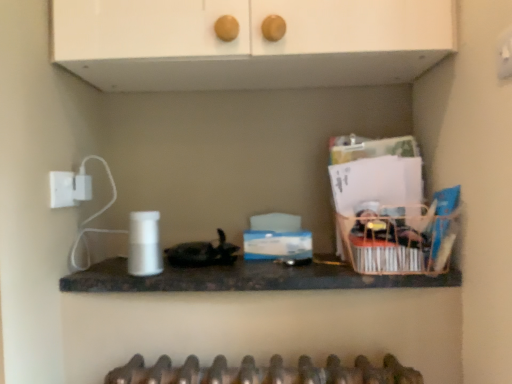
Describe the element at coordinates (398, 242) in the screenshot. I see `wooden basket at right` at that location.

Locate an element on the screen. This screenshot has width=512, height=384. wooden basket at right is located at coordinates (398, 242).

Where is `black marble countertop at center`? black marble countertop at center is located at coordinates (244, 278).

What do you see at coordinates (249, 43) in the screenshot? I see `white matte cabinet at upper center` at bounding box center [249, 43].

This screenshot has width=512, height=384. Identify the location of wooden basket at right. (398, 242).

Is black marble countertop at center positioned beyond the bounds of white matte cabinet at upper center?

That's correct, black marble countertop at center is outside of white matte cabinet at upper center.

From a real-world perspective, between black marble countertop at center and white matte cabinet at upper center, who is vertically higher?

In real-world perspective, white matte cabinet at upper center is above.

Which object is positioned more to the right, black marble countertop at center or white matte cabinet at upper center?

From the viewer's perspective, black marble countertop at center appears more on the right side.

What's the angular difference between black marble countertop at center and white matte cabinet at upper center's facing directions?

The facing directions of black marble countertop at center and white matte cabinet at upper center are 0.407 degrees apart.

Between black marble countertop at center and wooden basket at right, which one has more height?

wooden basket at right is taller.

Is black marble countertop at center far away from wooden basket at right?

No, there isn't a large distance between black marble countertop at center and wooden basket at right.

Which point is more distant from viewer, (242, 289) or (423, 253)?

The point (242, 289) is more distant.

Is white matte cabinet at upper center inside or outside of wooden basket at right?

white matte cabinet at upper center exists outside the volume of wooden basket at right.

Who is bigger, white matte cabinet at upper center or wooden basket at right?

With larger size is white matte cabinet at upper center.

Which of these two, white matte cabinet at upper center or wooden basket at right, stands taller?

Standing taller between the two is white matte cabinet at upper center.

From a real-world perspective, is white matte cabinet at upper center below wooden basket at right?

No.

From a real-world perspective, is wooden basket at right positioned above or below white matte cabinet at upper center?

wooden basket at right is situated lower than white matte cabinet at upper center in the real world.

Which of these two, wooden basket at right or white matte cabinet at upper center, is bigger?

Bigger between the two is white matte cabinet at upper center.

Would you say white matte cabinet at upper center is part of wooden basket at right's contents?

No, white matte cabinet at upper center is not surrounded by wooden basket at right.

Between point (375, 238) and point (159, 61), which one is positioned in front?

The point (375, 238) is closer to the camera.

Considering the relative positions of white matte cabinet at upper center and black marble countertop at center in the image provided, is white matte cabinet at upper center to the left or to the right of black marble countertop at center?

Based on their positions, white matte cabinet at upper center is located to the left of black marble countertop at center.

Which is correct: white matte cabinet at upper center is inside black marble countertop at center, or outside of it?

The correct answer is: outside.

Is white matte cabinet at upper center far away from black marble countertop at center?

white matte cabinet at upper center is actually quite close to black marble countertop at center.

How distant is white matte cabinet at upper center from black marble countertop at center?

white matte cabinet at upper center and black marble countertop at center are 20.85 inches apart.

Is wooden basket at right thinner than black marble countertop at center?

Correct, the width of wooden basket at right is less than that of black marble countertop at center.

Can you confirm if wooden basket at right is taller than black marble countertop at center?

Correct, wooden basket at right is much taller as black marble countertop at center.

Is wooden basket at right at the left side of black marble countertop at center?

No, wooden basket at right is not to the left of black marble countertop at center.

The image size is (512, 384). Identify the location of countertop that appears below the wooden basket at right (from a real-world perspective). (244, 278).

The height and width of the screenshot is (384, 512). I want to click on countertop beneath the white matte cabinet at upper center (from a real-world perspective), so click(x=244, y=278).

Where is `basket above the black marble countertop at center (from a real-world perspective)`? The image size is (512, 384). basket above the black marble countertop at center (from a real-world perspective) is located at coordinates (398, 242).

Estimate the real-world distances between objects in this image. Which object is further from wooden basket at right, black marble countertop at center or white matte cabinet at upper center?

white matte cabinet at upper center is further to wooden basket at right.

When comparing their distances from white matte cabinet at upper center, does wooden basket at right or black marble countertop at center seem further?

black marble countertop at center is positioned further to the anchor white matte cabinet at upper center.

Based on their spatial positions, is white matte cabinet at upper center or wooden basket at right closer to black marble countertop at center?

The object closer to black marble countertop at center is wooden basket at right.

From the picture: From the image, which object appears to be nearer to black marble countertop at center, wooden basket at right or white matte cabinet at upper center?

wooden basket at right lies closer to black marble countertop at center than the other object.

In the scene shown: From the image, which object appears to be farther from wooden basket at right, white matte cabinet at upper center or black marble countertop at center?

Among the two, white matte cabinet at upper center is located further to wooden basket at right.

From the image, which object appears to be farther from white matte cabinet at upper center, black marble countertop at center or wooden basket at right?

black marble countertop at center lies further to white matte cabinet at upper center than the other object.

The height and width of the screenshot is (384, 512). In order to click on basket that lies between white matte cabinet at upper center and black marble countertop at center from top to bottom in this screenshot , I will do `click(398, 242)`.